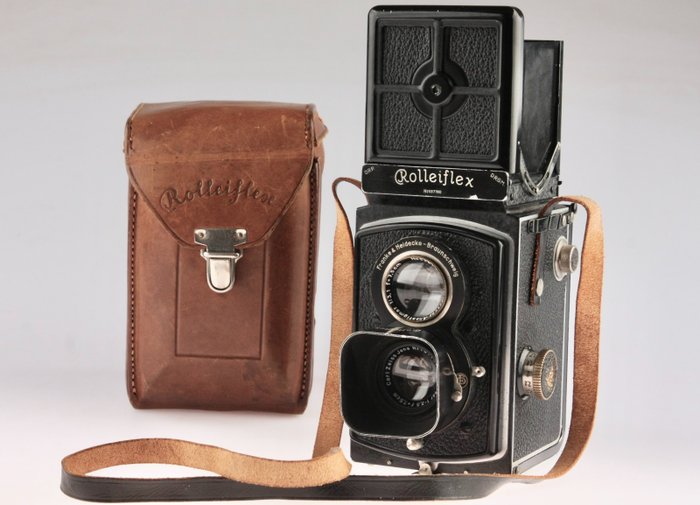
At what (x,y) coordinates should I click in order to perform the action: click on leather. Please return your answer as a coordinate pair (x, y). Image resolution: width=700 pixels, height=505 pixels. Looking at the image, I should click on (190, 302).